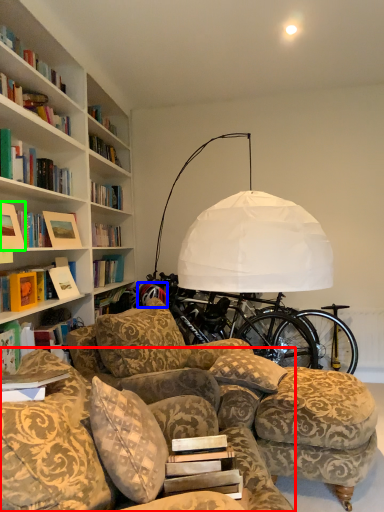
Question: Which object is the closest to the studio couch (highlighted by a red box)? Choose among these: wheel (highlighted by a blue box) or picture frame (highlighted by a green box).

Choices:
 (A) wheel
 (B) picture frame

Answer: (B)